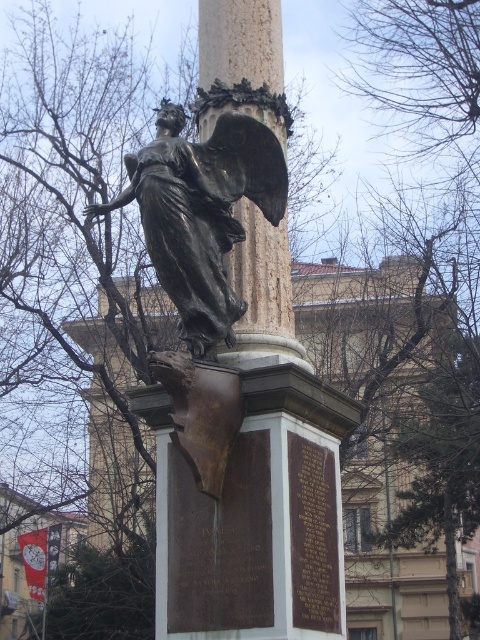
Question: Which point is farther to the camera?

Choices:
 (A) marble column at center
 (B) bronze statue at center

Answer: (A)

Question: Does bronze statue at center appear on the left side of marble column at center?

Choices:
 (A) no
 (B) yes

Answer: (B)

Question: Which point is farther to the camera?

Choices:
 (A) (245, 241)
 (B) (169, 198)

Answer: (A)

Question: Can you confirm if bronze statue at center is thinner than marble column at center?

Choices:
 (A) no
 (B) yes

Answer: (A)

Question: Which of the following is the farthest from the observer?

Choices:
 (A) [x=180, y=236]
 (B) [x=249, y=321]

Answer: (B)

Question: Is bronze statue at center bigger than marble column at center?

Choices:
 (A) yes
 (B) no

Answer: (B)